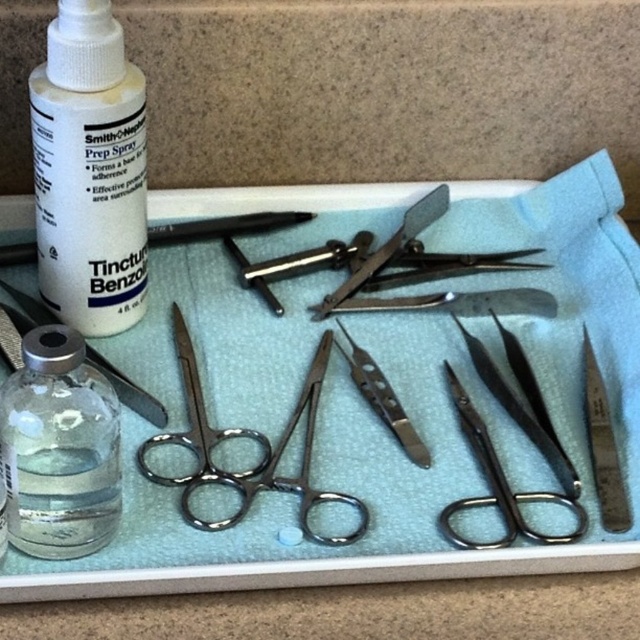
Question: Which object is farther from the camera taking this photo?

Choices:
 (A) polished stainless steel scissors at center
 (B) silver metallic scalpel at right

Answer: (B)

Question: Is polished silver scissors at center thinner than satin silver scalpel at center?

Choices:
 (A) yes
 (B) no

Answer: (B)

Question: Does polished silver scissors at lower right have a smaller size compared to satin silver scalpel at center?

Choices:
 (A) yes
 (B) no

Answer: (B)

Question: Which point is farther from the camera taking this photo?

Choices:
 (A) (323, 328)
 (B) (189, 486)

Answer: (A)

Question: Which object is closer to the camera taking this photo?

Choices:
 (A) metallic scissors at center-left
 (B) polished metal scissors at center
 (C) satin silver scalpel at center

Answer: (A)

Question: Does polished silver scissors at center have a greater width compared to polished metal scissors at center?

Choices:
 (A) yes
 (B) no

Answer: (B)